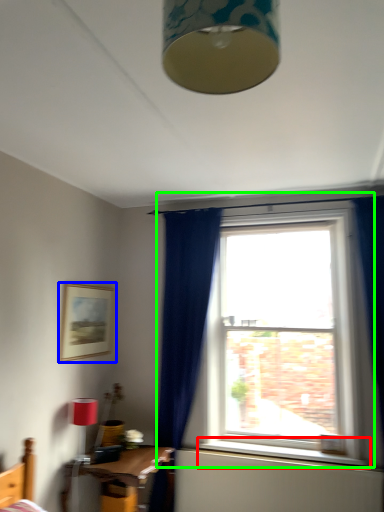
Question: Estimate the real-world distances between objects in this image. Which object is farther from window sill (highlighted by a red box), picture frame (highlighted by a blue box) or window (highlighted by a green box)?

Choices:
 (A) picture frame
 (B) window

Answer: (A)